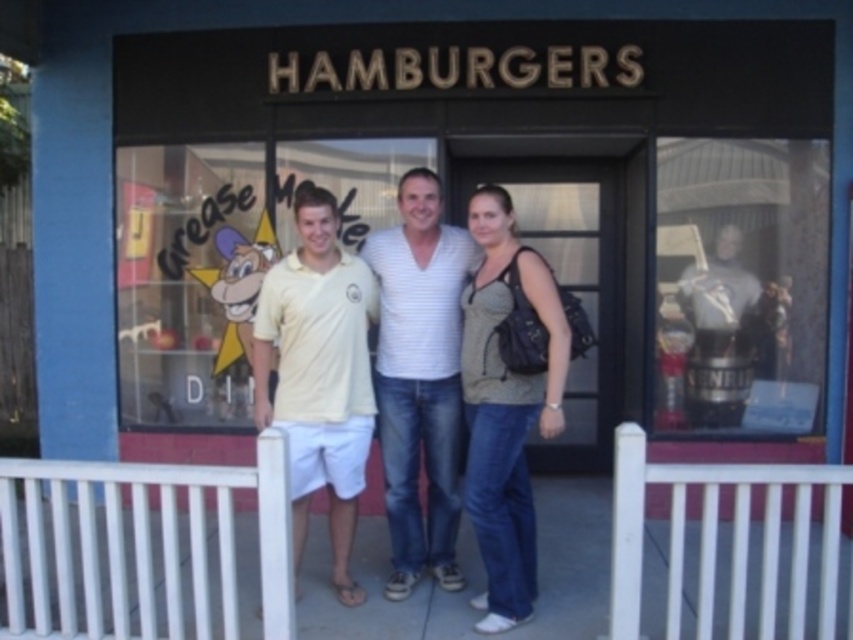
How much distance is there between light yellow cotton shirt at center and yellow cotton polo shirt at center?

The distance of light yellow cotton shirt at center from yellow cotton polo shirt at center is 12.30 inches.

Consider the image. Does light yellow cotton shirt at center appear on the left side of yellow cotton polo shirt at center?

Incorrect, light yellow cotton shirt at center is not on the left side of yellow cotton polo shirt at center.

Between point (410, 392) and point (351, 433), which one is positioned behind?

Point (410, 392)

The height and width of the screenshot is (640, 853). What are the coordinates of `light yellow cotton shirt at center` in the screenshot? It's located at (421, 372).

Who is taller, white striped shirt at center or matte gray tank top at center?

With more height is white striped shirt at center.

How much distance is there between white striped shirt at center and matte gray tank top at center?

white striped shirt at center and matte gray tank top at center are 14.75 inches apart from each other.

Locate an element on the screen. The width and height of the screenshot is (853, 640). white striped shirt at center is located at coordinates (421, 376).

Is white wooden fence at center shorter than white striped shirt at center?

Yes, white wooden fence at center is shorter than white striped shirt at center.

Which is in front, point (184, 483) or point (453, 396)?

Positioned in front is point (184, 483).

Does point (224, 493) come farther from viewer compared to point (380, 365)?

No, (224, 493) is in front of (380, 365).

I want to click on white wooden fence at center, so click(143, 544).